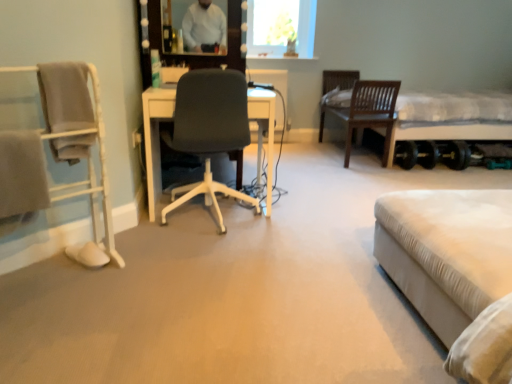
Image resolution: width=512 pixels, height=384 pixels. Describe the element at coordinates (209, 131) in the screenshot. I see `black fabric chair at center, which is counted as the 2th chair, starting from the back` at that location.

In the scene shown: What is the approximate width of dark wood chair at center, which ranks as the 3th chair in left-to-right order?

dark wood chair at center, which ranks as the 3th chair in left-to-right order, is 17.72 inches wide.

Where is `transparent glass vase at upper center`? The width and height of the screenshot is (512, 384). transparent glass vase at upper center is located at coordinates (280, 27).

Which is correct: white fabric bed at right, arranged as the 2th bed when viewed from the left, is inside black fabric chair at center, which is counted as the 2th chair, starting from the back, or outside of it?

white fabric bed at right, arranged as the 2th bed when viewed from the left, is outside black fabric chair at center, which is counted as the 2th chair, starting from the back.

Which object is positioned more to the right, white fabric bed at right, arranged as the first bed when viewed from the right, or black fabric chair at center, which is counted as the 2th chair, starting from the back?

white fabric bed at right, arranged as the first bed when viewed from the right.

Which of these two, white fabric bed at right, the 1th bed positioned from the top, or black fabric chair at center, the 2th chair positioned from the front, is wider?

With larger width is white fabric bed at right, the 1th bed positioned from the top.

Where is `bed behind the black fabric chair at center, the 2th chair positioned from the front`? The height and width of the screenshot is (384, 512). bed behind the black fabric chair at center, the 2th chair positioned from the front is located at coordinates (443, 122).

Consider the image. Looking at the image, does white fabric chair at left, placed as the 1th chair when sorted from left to right, seem bigger or smaller compared to black fabric chair at center, which appears as the 2th chair when viewed from the right?

Clearly, white fabric chair at left, placed as the 1th chair when sorted from left to right, is smaller in size than black fabric chair at center, which appears as the 2th chair when viewed from the right.

From a real-world perspective, which object rests below the other?

In real-world perspective, black fabric chair at center, which appears as the 2th chair when viewed from the right, is lower.

From the image's perspective, is white fabric chair at left, which is the 1th chair from front to back, located above or below black fabric chair at center, which is counted as the 2th chair, starting from the back?

white fabric chair at left, which is the 1th chair from front to back, is below black fabric chair at center, which is counted as the 2th chair, starting from the back.

Is point (362, 116) closer or farther from the camera than point (97, 216)?

Point (362, 116).

From the image's perspective, does dark wood chair at center, which is the first chair in right-to-left order, appear higher than white fabric chair at left, positioned as the 3th chair in back-to-front order?

Yes.

Which object is further away from the camera taking this photo, dark wood chair at center, which is the first chair in right-to-left order, or white fabric chair at left, positioned as the 3th chair in back-to-front order?

dark wood chair at center, which is the first chair in right-to-left order, is more distant.

Considering the sizes of dark wood chair at center, the 1th chair positioned from the back, and white fabric chair at left, placed as the 1th chair when sorted from left to right, in the image, is dark wood chair at center, the 1th chair positioned from the back, taller or shorter than white fabric chair at left, placed as the 1th chair when sorted from left to right,?

In the image, dark wood chair at center, the 1th chair positioned from the back, appears to be shorter than white fabric chair at left, placed as the 1th chair when sorted from left to right.

Visually, is matte white mirror at upper center positioned to the left or to the right of dark wood chair at center, arranged as the third chair when viewed from the front?

In the image, matte white mirror at upper center appears on the left side of dark wood chair at center, arranged as the third chair when viewed from the front.

Where is `mirror on the left of dark wood chair at center, the 1th chair positioned from the back`? The height and width of the screenshot is (384, 512). mirror on the left of dark wood chair at center, the 1th chair positioned from the back is located at coordinates (195, 26).

Who is more distant, matte white mirror at upper center or dark wood chair at center, which ranks as the 3th chair in left-to-right order?

dark wood chair at center, which ranks as the 3th chair in left-to-right order, is further from the camera.

What's the angular difference between matte white mirror at upper center and dark wood chair at center, which ranks as the 3th chair in left-to-right order,'s facing directions?

The angular difference between matte white mirror at upper center and dark wood chair at center, which ranks as the 3th chair in left-to-right order, is 90.8 degrees.

From the picture: Is black fabric chair at center, the 2th chair from the left, aimed at matte white mirror at upper center?

No, black fabric chair at center, the 2th chair from the left, is not facing towards matte white mirror at upper center.

Which object is wider, black fabric chair at center, the 2th chair from the left, or matte white mirror at upper center?

Wider between the two is black fabric chair at center, the 2th chair from the left.

Is black fabric chair at center, the 2th chair positioned from the front, beside matte white mirror at upper center?

No, black fabric chair at center, the 2th chair positioned from the front, is not next to matte white mirror at upper center.

From the image's perspective, which one is positioned lower, black fabric chair at center, the 2th chair positioned from the front, or matte white mirror at upper center?

From the image's view, black fabric chair at center, the 2th chair positioned from the front, is below.

Which is closer, (274, 28) or (447, 127)?

Point (274, 28) is positioned farther from the camera compared to point (447, 127).

From the image's perspective, is transparent glass vase at upper center under white fabric bed at right, which is the 2th bed in front-to-back order?

Actually, transparent glass vase at upper center appears above white fabric bed at right, which is the 2th bed in front-to-back order, in the image.

Is transparent glass vase at upper center in front of or behind white fabric bed at right, the 1th bed positioned from the top, in the image?

Visually, transparent glass vase at upper center is located behind white fabric bed at right, the 1th bed positioned from the top.

Is white fabric bed at right, the 2th bed from the bottom, inside transparent glass vase at upper center?

No, white fabric bed at right, the 2th bed from the bottom, is not inside transparent glass vase at upper center.

From the image's perspective, is white fabric bed at lower right, which ranks as the 1th bed in bottom-to-top order, above or below white fabric bed at right, which is the 2th bed in front-to-back order?

Clearly, from the image's perspective, white fabric bed at lower right, which ranks as the 1th bed in bottom-to-top order, is below white fabric bed at right, which is the 2th bed in front-to-back order.

Is white fabric bed at lower right, the first bed when ordered from front to back, positioned with its back to white fabric bed at right, which is the 2th bed in front-to-back order?

No, white fabric bed at right, which is the 2th bed in front-to-back order, is not at the back of white fabric bed at lower right, the first bed when ordered from front to back.

At what (x,y) coordinates should I click in order to perform the action: click on the 2nd chair below when counting from the white fabric bed at right, the 1th bed when ordered from back to front (from the image's perspective). Please return your answer as a coordinate pair (x, y). Image resolution: width=512 pixels, height=384 pixels. Looking at the image, I should click on (209, 131).

From a real-world perspective, starting from the white fabric chair at left, acting as the 3th chair starting from the right, which chair is the 1st one below it? Please provide its 2D coordinates.

[(209, 131)]

Based on their spatial positions, is white fabric bed at lower right, the first bed when ordered from front to back, or dark wood chair at center, arranged as the third chair when viewed from the front, further from black fabric chair at center, which appears as the 2th chair when viewed from the right?

dark wood chair at center, arranged as the third chair when viewed from the front, is positioned further to the anchor black fabric chair at center, which appears as the 2th chair when viewed from the right.

When comparing their distances from black fabric chair at center, which appears as the 2th chair when viewed from the right, does dark wood chair at center, arranged as the third chair when viewed from the front, or white fabric bed at lower right, the second bed from the back, seem further?

dark wood chair at center, arranged as the third chair when viewed from the front, lies further to black fabric chair at center, which appears as the 2th chair when viewed from the right, than the other object.

Considering their positions, is transparent glass vase at upper center positioned closer to matte white mirror at upper center than dark wood chair at center, the 1th chair positioned from the back?

dark wood chair at center, the 1th chair positioned from the back.

Looking at the image, which one is located further to black fabric chair at center, which is counted as the 2th chair, starting from the back, white fabric bed at right, the 1th bed when ordered from back to front, or matte white mirror at upper center?

The object further to black fabric chair at center, which is counted as the 2th chair, starting from the back, is white fabric bed at right, the 1th bed when ordered from back to front.

Based on their spatial positions, is white fabric bed at right, arranged as the first bed when viewed from the right, or white fabric bed at lower right, acting as the 2th bed starting from the top, further from black fabric chair at center, the 2th chair from the left?

Among the two, white fabric bed at right, arranged as the first bed when viewed from the right, is located further to black fabric chair at center, the 2th chair from the left.

Looking at the image, which one is located further to dark wood chair at center, the 1th chair positioned from the back, black fabric chair at center, which appears as the 2th chair when viewed from the right, or matte white mirror at upper center?

black fabric chair at center, which appears as the 2th chair when viewed from the right, is positioned further to the anchor dark wood chair at center, the 1th chair positioned from the back.

Considering their positions, is white fabric bed at right, arranged as the 2th bed when viewed from the left, positioned closer to white fabric bed at lower right, the second bed from the back, than dark wood chair at center, which is the first chair in right-to-left order?

dark wood chair at center, which is the first chair in right-to-left order, is closer to white fabric bed at lower right, the second bed from the back.

Considering their positions, is white fabric bed at lower right, the first bed when ordered from front to back, positioned further to transparent glass vase at upper center than matte white mirror at upper center?

white fabric bed at lower right, the first bed when ordered from front to back.

Identify the location of chair between matte white mirror at upper center and dark wood chair at center, arranged as the third chair when viewed from the front, from left to right. (209, 131).

I want to click on mirror between white fabric bed at lower right, acting as the 2th bed starting from the top, and transparent glass vase at upper center from front to back, so click(x=195, y=26).

What are the coordinates of `mirror situated between white fabric chair at left, positioned as the 3th chair in back-to-front order, and white fabric bed at lower right, which ranks as the 1th bed in bottom-to-top order, from left to right` in the screenshot? It's located at (195, 26).

Identify the location of bed between matte white mirror at upper center and white fabric bed at right, the 2th bed from the bottom, in the horizontal direction. (447, 252).